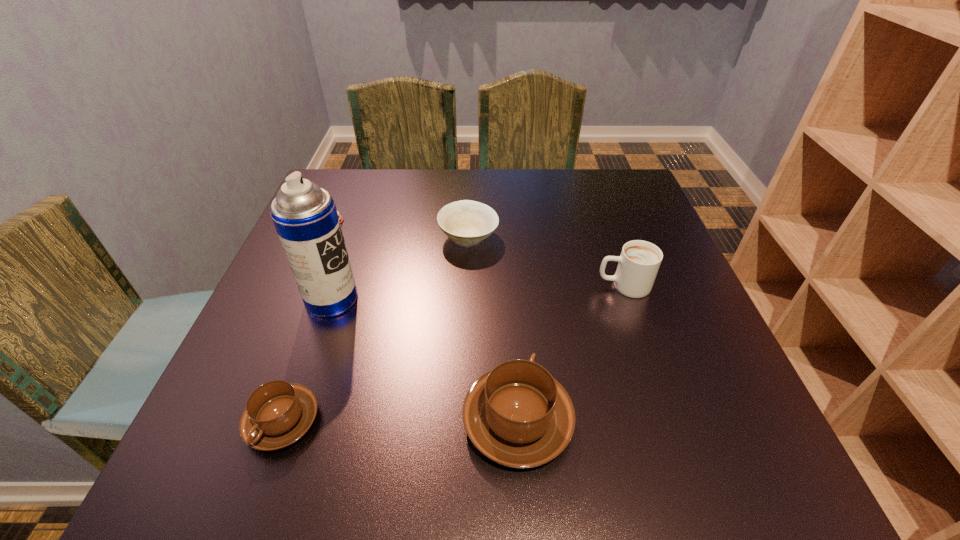
You are a GUI agent. You are given a task and a screenshot of the screen. Output one action in this format:
    pyautogui.click(x=<x>, y=<y>)
    Task: Click on the vacant space located 0.130m on the front of the chocolate cake
    Image resolution: width=960 pixels, height=540 pixels.
    Given the screenshot: What is the action you would take?
    pyautogui.click(x=312, y=272)

Image resolution: width=960 pixels, height=540 pixels. What are the coordinates of `free point located on the left of the bowl` in the screenshot? It's located at (381, 237).

Locate an element on the screen. free space located 0.290m on the label side of the tallest object is located at coordinates (495, 299).

Identify the location of free spot located on the side with the handle of the farthest cappuccino. This screenshot has height=540, width=960. (499, 286).

Find the location of `vacant space located on the side with the handle of the farthest cappuccino`. vacant space located on the side with the handle of the farthest cappuccino is located at coordinates (527, 286).

Locate an element on the screen. The height and width of the screenshot is (540, 960). vacant space located 0.370m on the side with the handle of the farthest cappuccino is located at coordinates (425, 286).

The image size is (960, 540). What are the coordinates of `object situated at the far edge` in the screenshot? It's located at (346, 218).

Locate an element on the screen. cappuccino that is positioned at the left edge is located at coordinates (278, 413).

In order to click on chocolate cake that is at the left edge in this screenshot , I will do `click(346, 218)`.

Locate an element on the screen. aerosol can present at the left edge is located at coordinates (305, 216).